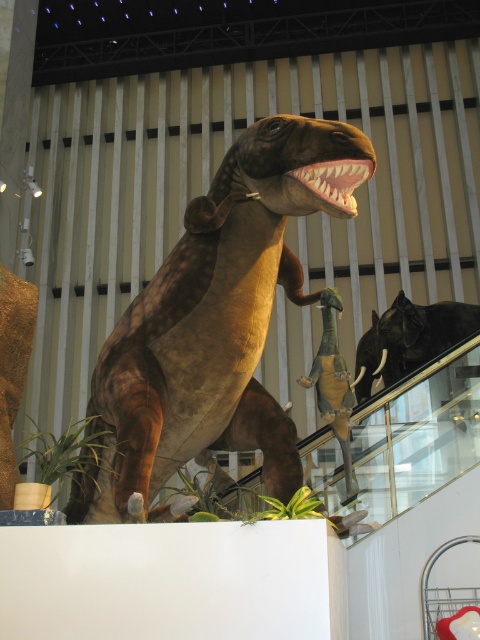
Which is more to the left, brown matte dinosaur at center or shiny green plastic dinosaur at center?

Positioned to the left is brown matte dinosaur at center.

Where is `brown matte dinosaur at center`? The image size is (480, 640). brown matte dinosaur at center is located at coordinates (214, 324).